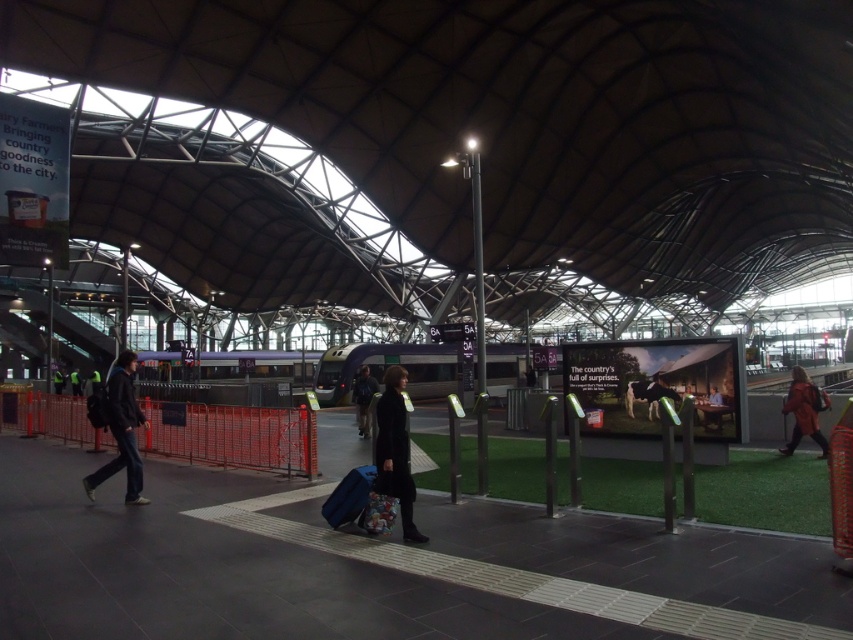
You are a traveler at the train station and need to decide which coat to take. You notice the dark matte coat at center and the orange leather jacket at right. Which coat is larger in size?

The dark matte coat at center is bigger than the orange leather jacket at right.

You are a photographer standing on the platform of the modern train station. You see the dark matte coat at center and the dark blue jeans at lower left. Which object would appear bigger in your camera viewfinder?

The dark matte coat at center appears bigger in the camera viewfinder because it is larger in size than the dark blue jeans at lower left.